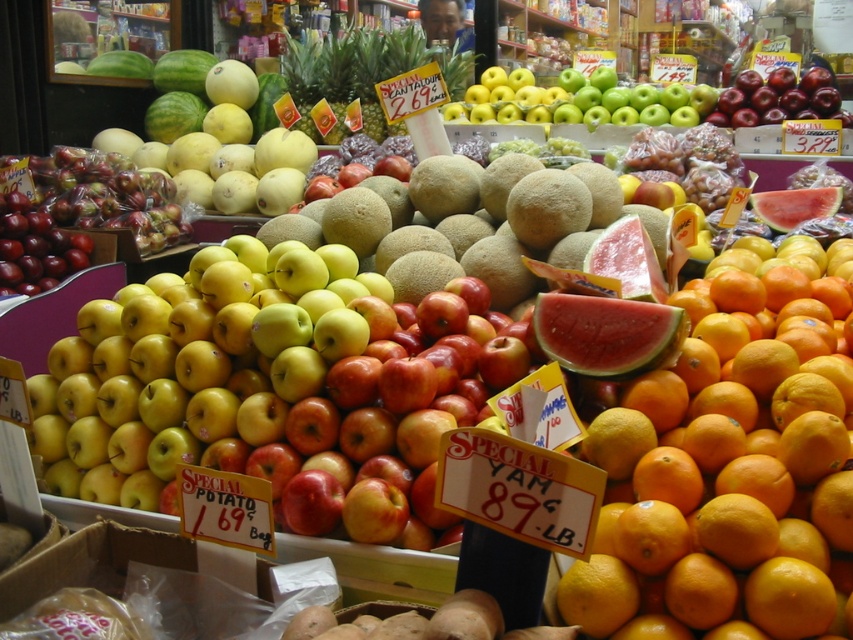
You are a customer looking at the fruit display. You want to pick up the shiny red apple at upper right but need to reach it without moving the watermelon rind at upper right. Is this possible based on their positions?

The shiny red apple at upper right is further to the viewer than the watermelon rind at upper right, so you can reach it without moving the watermelon rind at upper right because it is closer to you.

You are a customer trying to reach the shiny red apple at upper right and the watermelon rind at upper right. Which one is higher up?

The shiny red apple at upper right is much taller than the watermelon rind at upper right, so it is higher up.